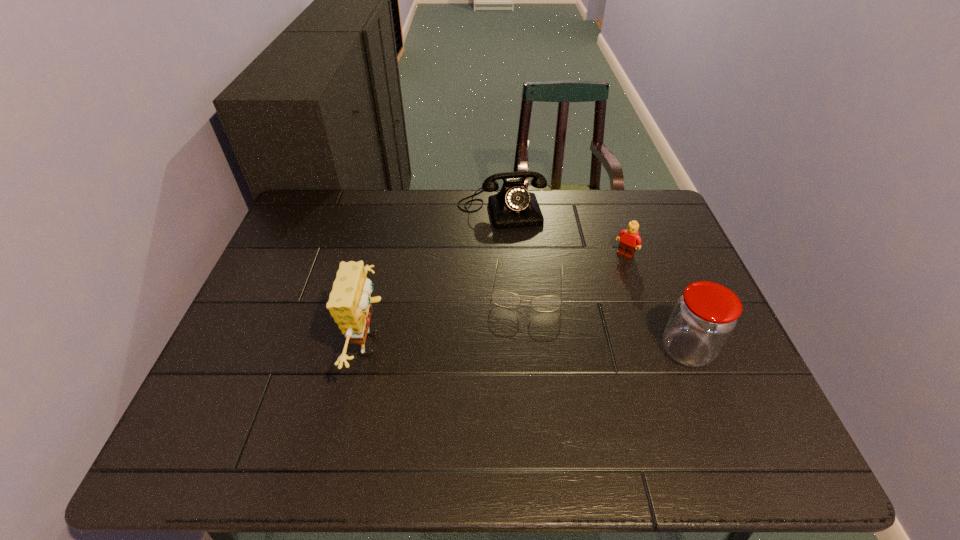
Locate an element on the screen. This screenshot has height=540, width=960. empty space that is in between the shortest object and the Lego is located at coordinates (576, 271).

Image resolution: width=960 pixels, height=540 pixels. In order to click on vacant area that lies between the jar and the spectacles in this screenshot , I will do `click(607, 318)`.

Identify the location of vacant area that lies between the shortest object and the farthest object. This screenshot has width=960, height=540. (515, 247).

In order to click on free space between the jar and the fourth nearest object in this screenshot , I will do `click(656, 302)`.

What are the coordinates of `vacant space that is in between the farthest object and the jar` in the screenshot? It's located at (594, 279).

This screenshot has width=960, height=540. In order to click on the fourth closest object to the leftmost object in this screenshot , I will do `click(704, 317)`.

Select which object appears as the fourth closest to the second tallest object. Please provide its 2D coordinates. Your answer should be formatted as a tuple, i.e. [(x, y)], where the tuple contains the x and y coordinates of a point satisfying the conditions above.

[(349, 304)]

Where is `vacant space that satisfies the following two spatial constraints: 1. on the front side of the fourth nearest object; 2. on the right side of the telephone`? vacant space that satisfies the following two spatial constraints: 1. on the front side of the fourth nearest object; 2. on the right side of the telephone is located at coordinates (504, 255).

Where is `free location that satisfies the following two spatial constraints: 1. on the back side of the spectacles; 2. on the right side of the Lego`? The image size is (960, 540). free location that satisfies the following two spatial constraints: 1. on the back side of the spectacles; 2. on the right side of the Lego is located at coordinates 524,255.